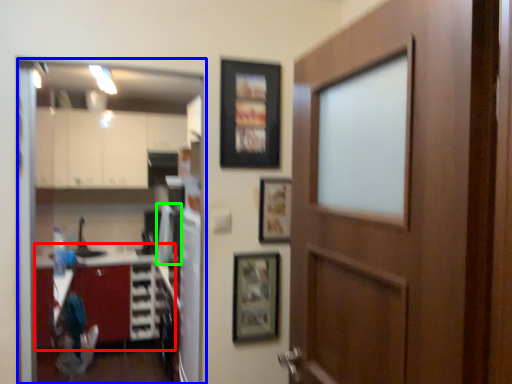
Question: Considering the real-world distances, which object is closest to cabinetry (highlighted by a red box)? glass door (highlighted by a blue box) or appliance (highlighted by a green box).

Choices:
 (A) glass door
 (B) appliance

Answer: (A)